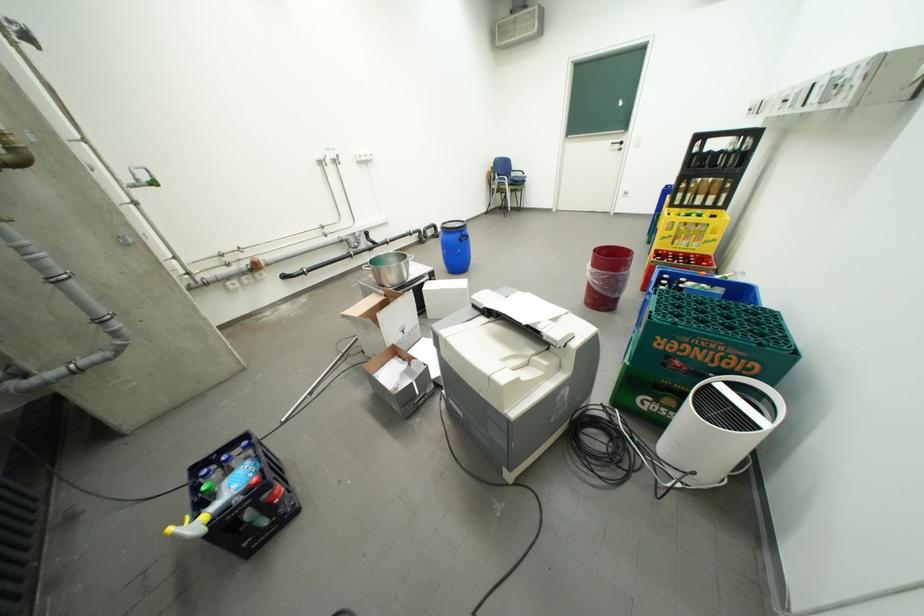
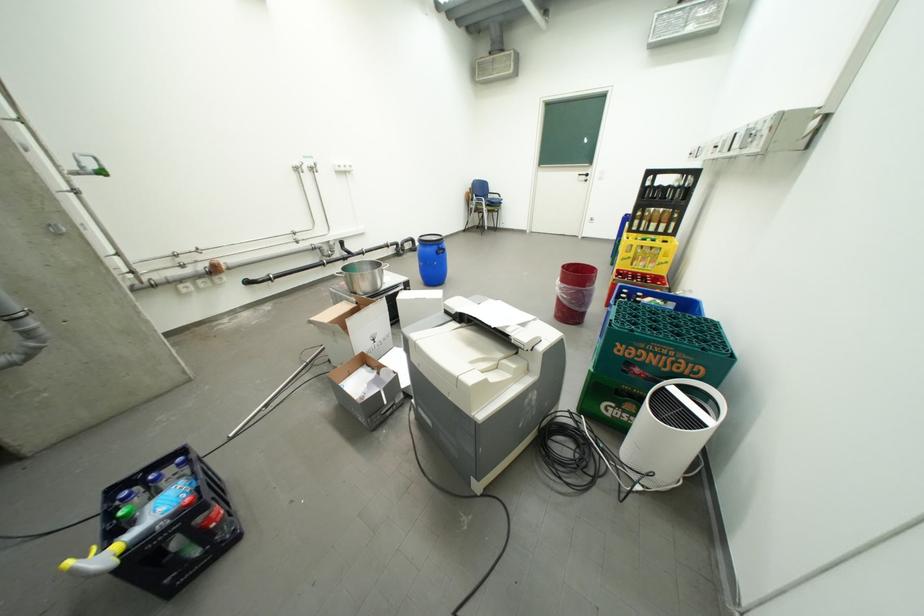
Question: The images are taken continuously from a first-person perspective. In which direction are you moving?

Choices:
 (A) Left
 (B) Right
 (C) Forward
 (D) Backward

Answer: (B)